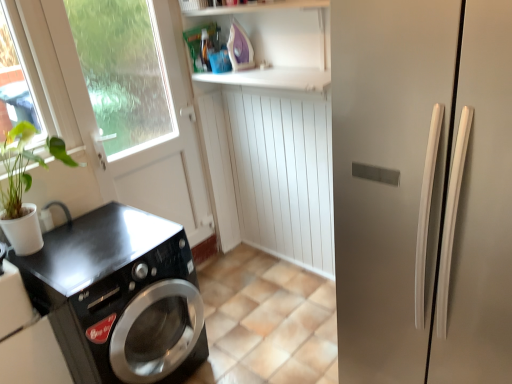
This screenshot has height=384, width=512. I want to click on vacant space to the right of black glossy washing machine at lower left, so click(243, 339).